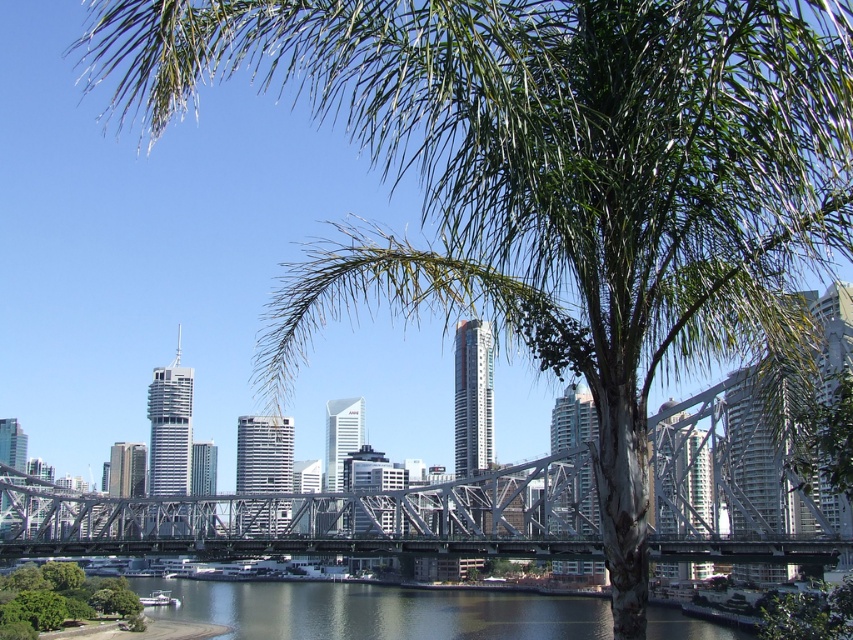
Question: Is metallic gray bridge at center thinner than dark blue water at lower center?

Choices:
 (A) yes
 (B) no

Answer: (B)

Question: Is metallic gray bridge at center positioned behind green leafy tree at lower left?

Choices:
 (A) no
 (B) yes

Answer: (A)

Question: Estimate the real-world distances between objects in this image. Which object is farther from the green leafy tree at lower left?

Choices:
 (A) green leafy tree at lower right
 (B) metallic gray bridge at center

Answer: (A)

Question: Among these points, which one is nearest to the camera?

Choices:
 (A) (505, 608)
 (B) (824, 637)
 (C) (704, 525)

Answer: (B)

Question: Which object is positioned closest to the green leafy tree at lower right?

Choices:
 (A) metallic gray bridge at center
 (B) dark blue water at lower center

Answer: (A)

Question: Does dark blue water at lower center appear over green leafy tree at lower right?

Choices:
 (A) yes
 (B) no

Answer: (B)